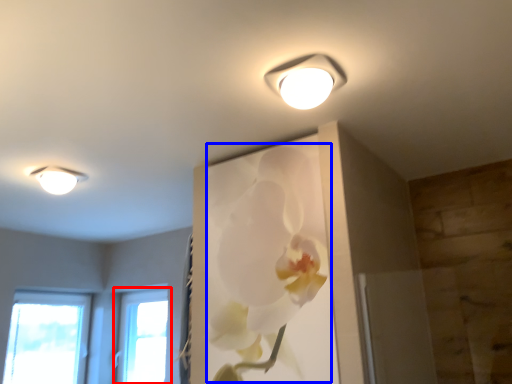
Question: Which object is closer to the camera taking this photo, window (highlighted by a red box) or floral arrangement (highlighted by a blue box)?

Choices:
 (A) window
 (B) floral arrangement

Answer: (B)